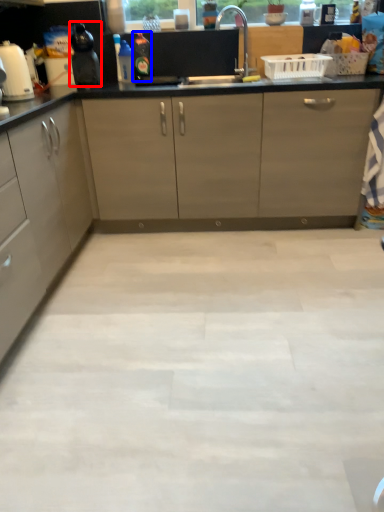
Question: Which object is closer to the camera taking this photo, kitchen appliance (highlighted by a red box) or bottle (highlighted by a blue box)?

Choices:
 (A) kitchen appliance
 (B) bottle

Answer: (A)